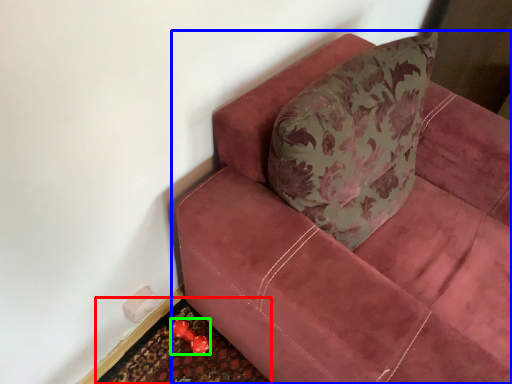
Question: Considering the real-world distances, which object is closest to doormat (highlighted by a red box)? studio couch (highlighted by a blue box) or toy (highlighted by a green box).

Choices:
 (A) studio couch
 (B) toy

Answer: (B)